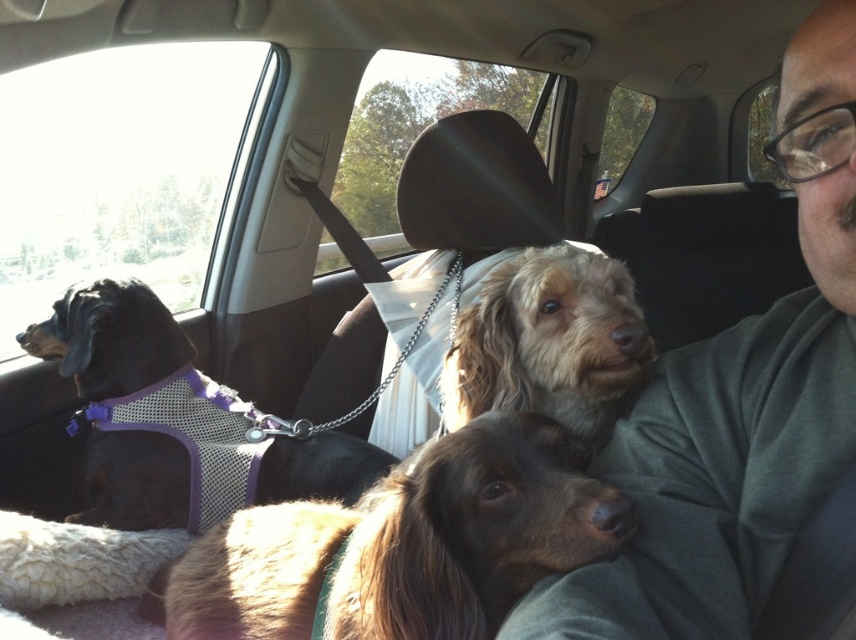
You are a passenger in the car and want to know if the black mesh vest at left has more space than the fuzzy brown dog at center. Based on their widths, can you confirm?

The black mesh vest at left is wider than the fuzzy brown dog at center, so yes, the black mesh vest at left does have more space.

You are a passenger in the car and see the gray cotton shirt at center and the fuzzy brown dog at center. Which object is wider?

The gray cotton shirt at center is wider than the fuzzy brown dog at center.

You are a passenger in the car and want to reach the gray cotton shirt at center to wipe your face. Can you reach it without moving the fuzzy brown dog at center?

The gray cotton shirt at center is below the fuzzy brown dog at center, so you can reach it without moving the dog.